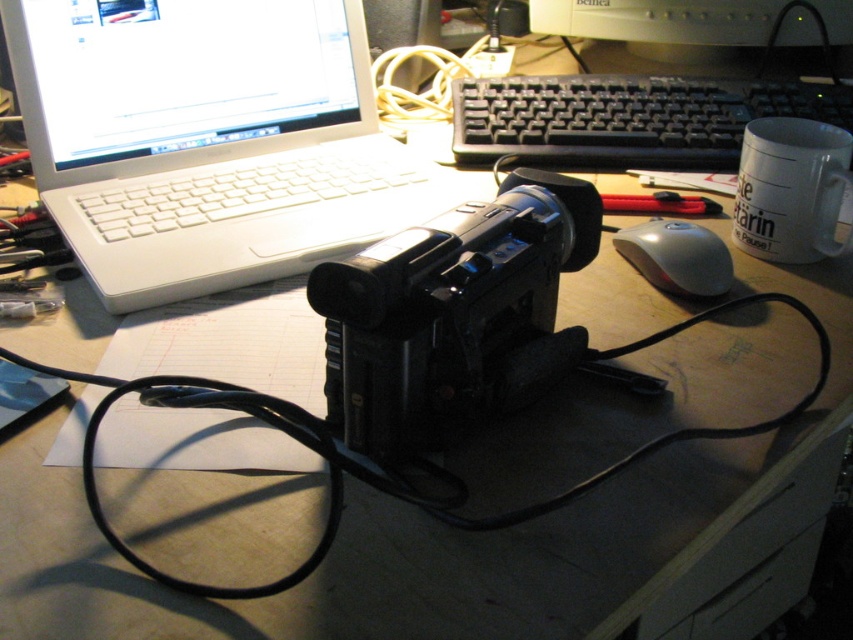
Who is shorter, black plastic keyboard at upper center or satin silver mouse at center right?

With less height is satin silver mouse at center right.

Describe the element at coordinates (625, 118) in the screenshot. I see `black plastic keyboard at upper center` at that location.

Is point (596, 161) more distant than point (693, 268)?

That is True.

Where is `black plastic keyboard at upper center`? Image resolution: width=853 pixels, height=640 pixels. black plastic keyboard at upper center is located at coordinates (625, 118).

Is white plastic laptop at upper left wider than black plastic camera at center?

Indeed, white plastic laptop at upper left has a greater width compared to black plastic camera at center.

Between point (267, 51) and point (415, 227), which one is positioned in front?

Positioned in front is point (415, 227).

At what (x,y) coordinates should I click in order to perform the action: click on white plastic laptop at upper left. Please return your answer as a coordinate pair (x, y). This screenshot has height=640, width=853. Looking at the image, I should click on (209, 140).

Locate an element on the screen. The image size is (853, 640). black plastic keyboard at upper center is located at coordinates (625, 118).

The height and width of the screenshot is (640, 853). What do you see at coordinates (625, 118) in the screenshot?
I see `black plastic keyboard at upper center` at bounding box center [625, 118].

Locate an element on the screen. black plastic keyboard at upper center is located at coordinates (625, 118).